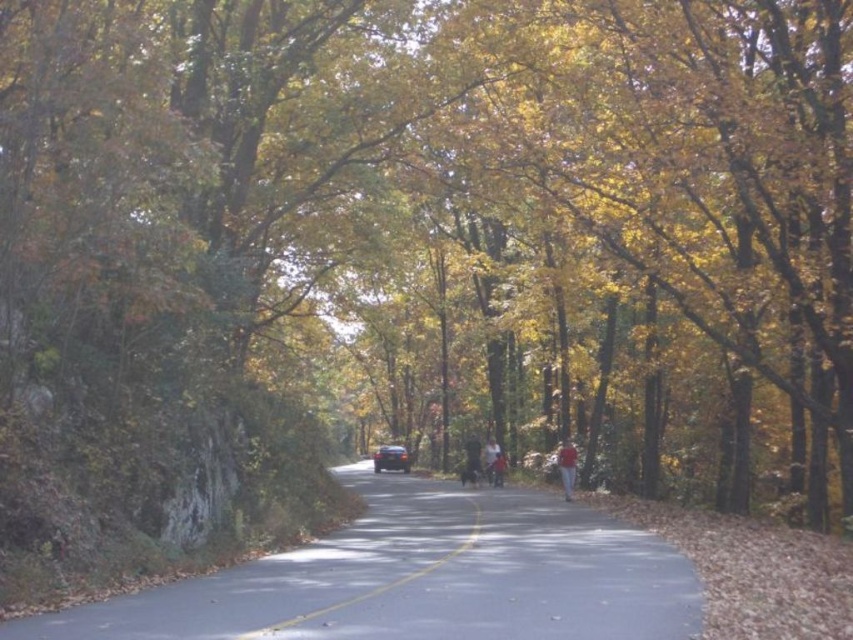
Does smooth asphalt road at center appear on the left side of shiny black car at center?

In fact, smooth asphalt road at center is to the right of shiny black car at center.

Who is higher up, smooth asphalt road at center or shiny black car at center?

smooth asphalt road at center

Is point (281, 627) positioned behind point (372, 458)?

That is False.

Image resolution: width=853 pixels, height=640 pixels. Identify the location of smooth asphalt road at center. (372, 588).

Which is more to the left, red fabric person at center or dark gray fabric jacket at center?

From the viewer's perspective, dark gray fabric jacket at center appears more on the left side.

Does red fabric person at center have a greater width compared to dark gray fabric jacket at center?

Indeed, red fabric person at center has a greater width compared to dark gray fabric jacket at center.

Between point (560, 474) and point (459, 472), which one is positioned in front?

Positioned in front is point (560, 474).

I want to click on red fabric person at center, so click(567, 467).

Can you confirm if smooth asphalt road at center is thinner than dark gray fabric jacket at center?

No.

Find the location of a particular element. The height and width of the screenshot is (640, 853). smooth asphalt road at center is located at coordinates (372, 588).

This screenshot has width=853, height=640. What are the coordinates of `smooth asphalt road at center` in the screenshot? It's located at (372, 588).